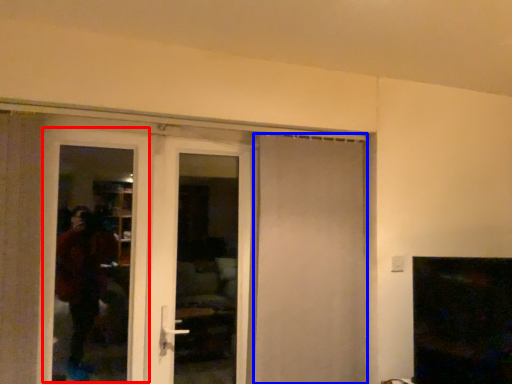
Question: Which object appears farthest to the camera in this image, screen door (highlighted by a red box) or door (highlighted by a blue box)?

Choices:
 (A) screen door
 (B) door

Answer: (B)